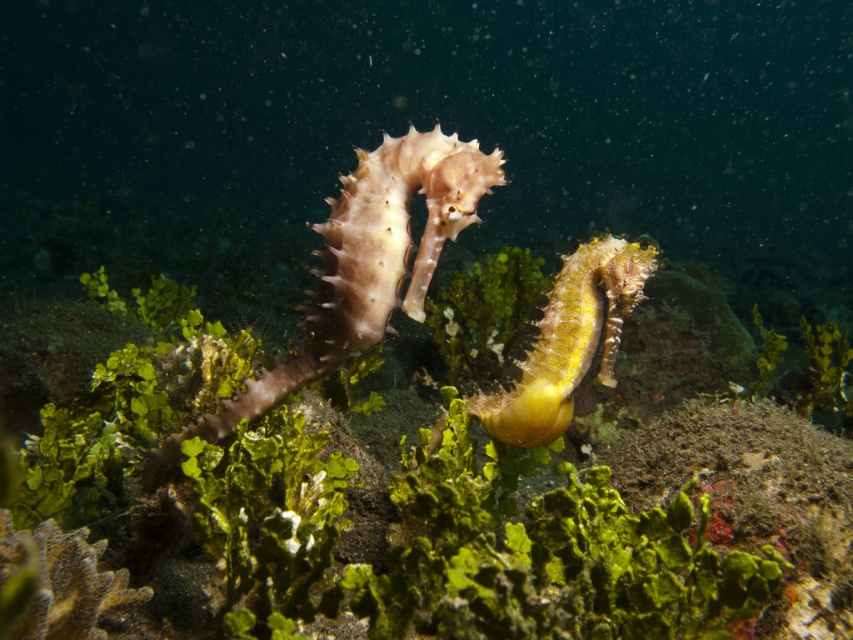
You are a marine biologist observing an underwater scene with a green mossy coral at center and a yellow matte seahorse at center. From your vantage point, which object is positioned lower in the frame?

The green mossy coral at center is located below the yellow matte seahorse at center, so it is positioned lower in the frame.

You are a marine biologist observing the underwater scene. You notice both the smooth pink seahorse at center and the yellow matte seahorse at center. Which seahorse is positioned closer to your viewpoint?

The smooth pink seahorse at center is closer to the viewer than the yellow matte seahorse at center.